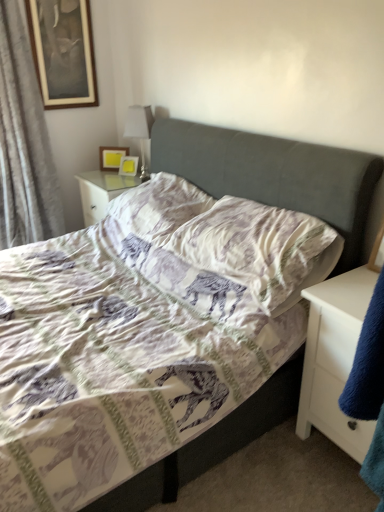
Question: From the image's perspective, relative to gray fabric curtain at left, is white glossy table lamp at upper center above or below?

Choices:
 (A) below
 (B) above

Answer: (A)

Question: In terms of width, does white glossy table lamp at upper center look wider or thinner when compared to gray fabric curtain at left?

Choices:
 (A) wide
 (B) thin

Answer: (B)

Question: Estimate the real-world distances between objects in this image. Which object is farther from the white matte nightstand at right?

Choices:
 (A) white fabric pillow at center, arranged as the first pillow when viewed from the back
 (B) matte yellow picture frame at upper left, which appears as the second picture frame when viewed from the top
 (C) white glossy table lamp at upper center
 (D) wooden-framed picture at upper left, which appears as the third picture frame when viewed from the right
 (E) matte yellow picture frame at upper center, placed as the third picture frame when sorted from left to right

Answer: (D)

Question: Estimate the real-world distances between objects in this image. Which object is closer to the gray fabric curtain at left?

Choices:
 (A) matte yellow picture frame at upper left, which appears as the second picture frame when viewed from the top
 (B) white fabric pillow at center, marked as the second pillow in a front-to-back arrangement
 (C) matte yellow picture frame at upper center, placed as the third picture frame when sorted from left to right
 (D) printed fabric pillow at center, the 2th pillow from the back
 (E) white matte nightstand at right

Answer: (A)